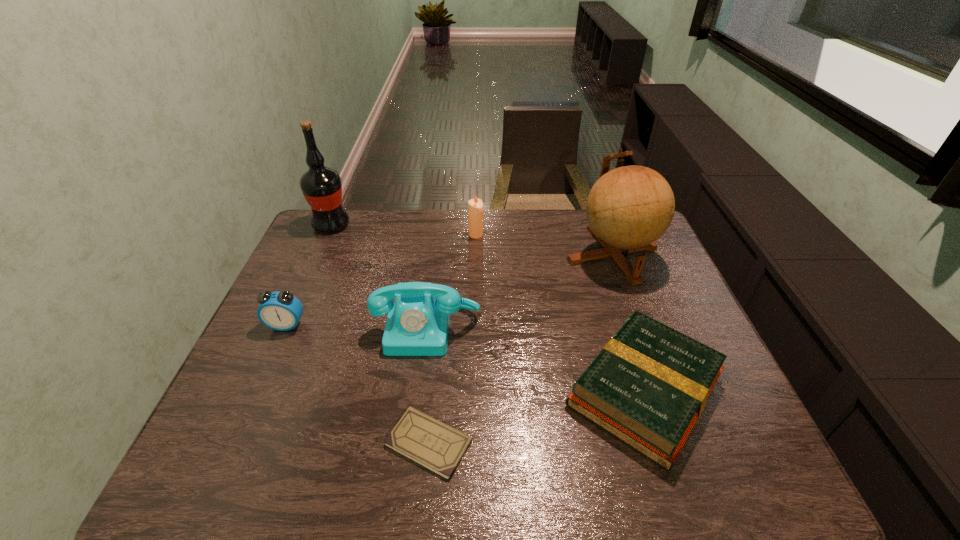
The height and width of the screenshot is (540, 960). What are the coordinates of `alarm clock located at the left edge` in the screenshot? It's located at (281, 311).

Find the location of `globe located in the right edge section of the desktop`. globe located in the right edge section of the desktop is located at coordinates (628, 208).

Image resolution: width=960 pixels, height=540 pixels. Find the location of `hardback book located at the right edge`. hardback book located at the right edge is located at coordinates (648, 386).

Identify the location of object positioned at the far left corner. (321, 186).

At what (x,y) coordinates should I click in order to perform the action: click on object at the far right corner. Please return your answer as a coordinate pair (x, y). The width and height of the screenshot is (960, 540). Looking at the image, I should click on (628, 208).

Locate an element on the screen. The image size is (960, 540). object located in the near right corner section of the desktop is located at coordinates (648, 386).

Find the location of `vacant space at the far edge of the desktop`. vacant space at the far edge of the desktop is located at coordinates (495, 248).

The height and width of the screenshot is (540, 960). I want to click on vacant space at the near edge of the desktop, so click(684, 455).

Locate an element on the screen. vacant region at the left edge is located at coordinates (300, 299).

In the image, there is a desktop. At what (x,y) coordinates should I click in order to perform the action: click on free space at the right edge. Please return your answer as a coordinate pair (x, y). The height and width of the screenshot is (540, 960). Looking at the image, I should click on (630, 256).